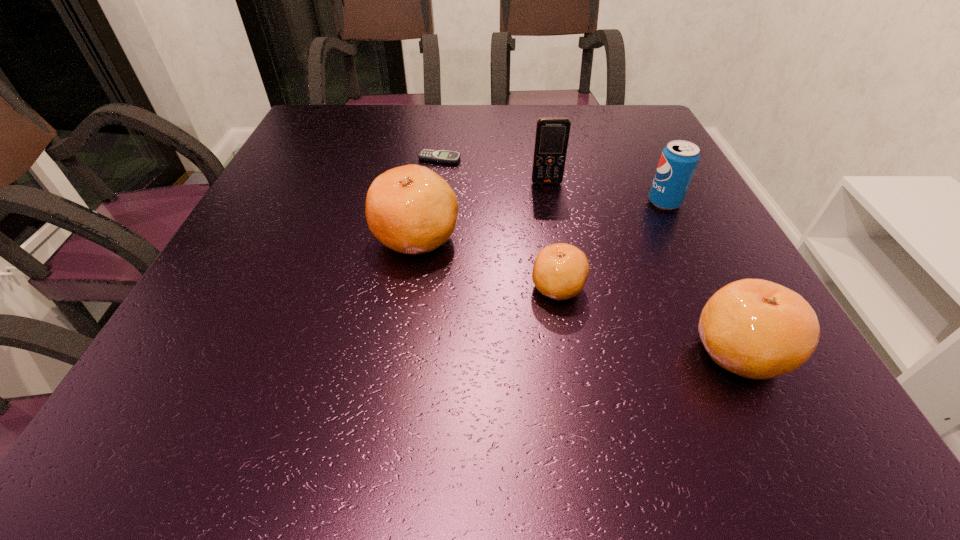
The clementines are evenly distributed in the image. To maintain this, where would you place another clementine on the left? Please point to a free space. Please provide its 2D coordinates. Your answer should be formatted as a tuple, i.e. [(x, y)], where the tuple contains the x and y coordinates of a point satisfying the conditions above.

[(303, 198)]